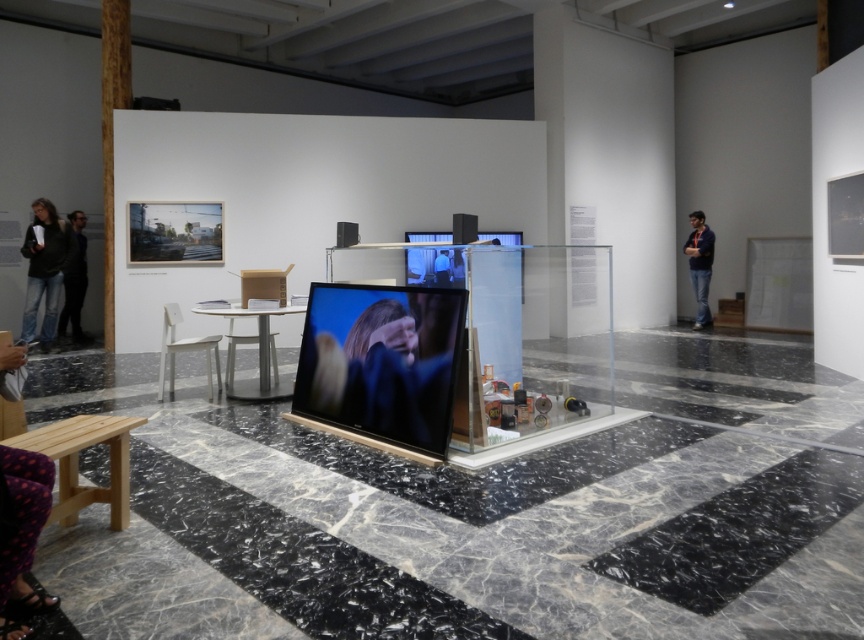
What do you see at coordinates (74, 280) in the screenshot? This screenshot has width=864, height=640. I see `dark blue jeans at left` at bounding box center [74, 280].

Which is below, dark blue jeans at left or dark blue shirt at right?

dark blue jeans at left

Is point (81, 337) positioned behind point (703, 320)?

No, (81, 337) is in front of (703, 320).

Find the location of a particular element. dark blue jeans at left is located at coordinates (74, 280).

Does blonde hair at center have a lesser height compared to smooth skin at center?

Correct, blonde hair at center is not as tall as smooth skin at center.

Can you confirm if blonde hair at center is smaller than smooth skin at center?

Incorrect, blonde hair at center is not smaller in size than smooth skin at center.

Which is behind, point (346, 337) or point (448, 259)?

Point (448, 259)

The height and width of the screenshot is (640, 864). In order to click on blonde hair at center in this screenshot , I will do `click(382, 330)`.

Is dark blue jeans at left closer to camera compared to smooth skin at center?

That is False.

Does dark blue jeans at left appear under smooth skin at center?

Yes.

What do you see at coordinates (74, 280) in the screenshot? I see `dark blue jeans at left` at bounding box center [74, 280].

Identify the location of dark blue jeans at left. Image resolution: width=864 pixels, height=640 pixels. (74, 280).